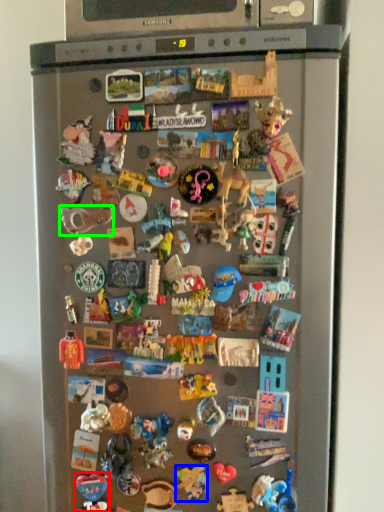
Question: Considering the real-world distances, which object is farthest from toy (highlighted by a red box)? toy (highlighted by a blue box) or toy (highlighted by a green box)?

Choices:
 (A) toy
 (B) toy

Answer: (B)